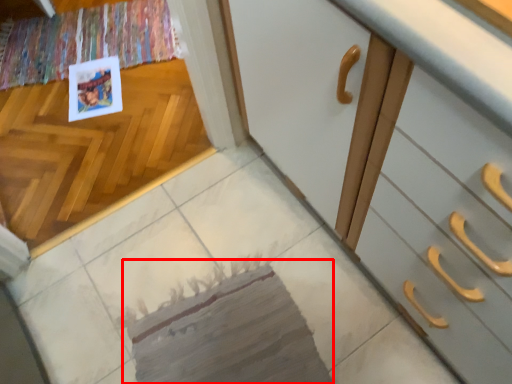
Question: Observing the image, what is the correct spatial positioning of mat (annotated by the red box) in reference to postcard?

Choices:
 (A) left
 (B) right

Answer: (B)